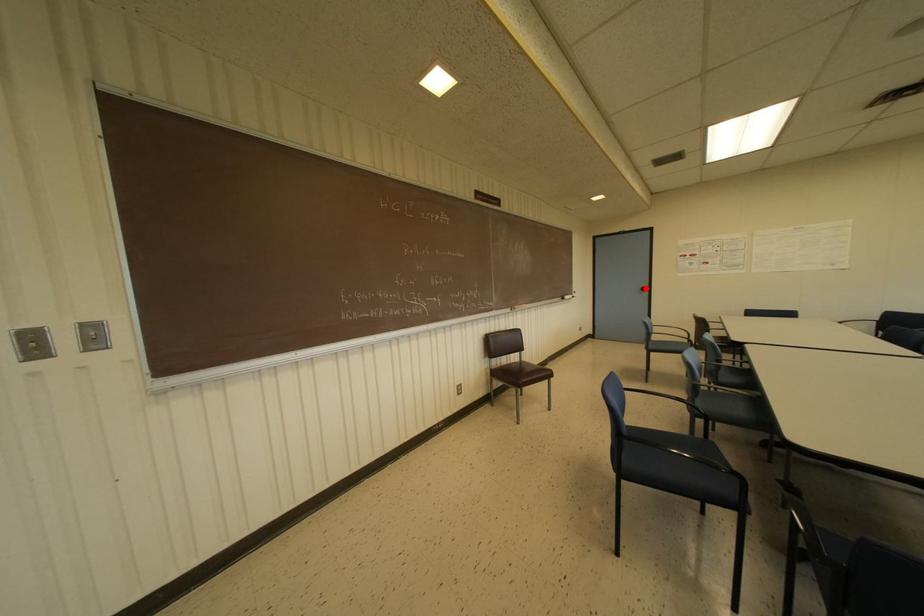
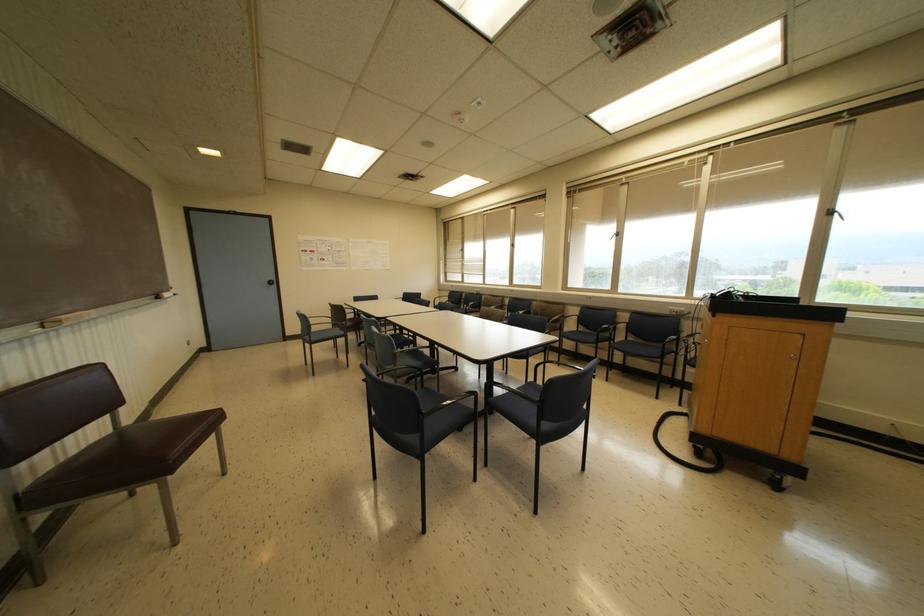
Question: I am providing you with two images of the same scene from different viewpoints. Image1 has a red point marked. In image2, the corresponding 3D location appears at what relative position? Reply with the corresponding letter.

Choices:
 (A) Closer
 (B) Farther

Answer: (B)